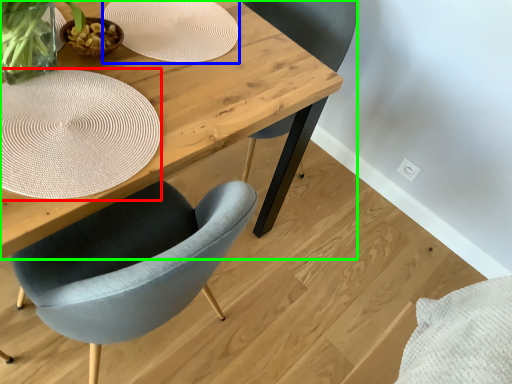
Question: Which is farther away from paper plate (highlighted by a red box)? paper plate (highlighted by a blue box) or table (highlighted by a green box)?

Choices:
 (A) paper plate
 (B) table

Answer: (A)